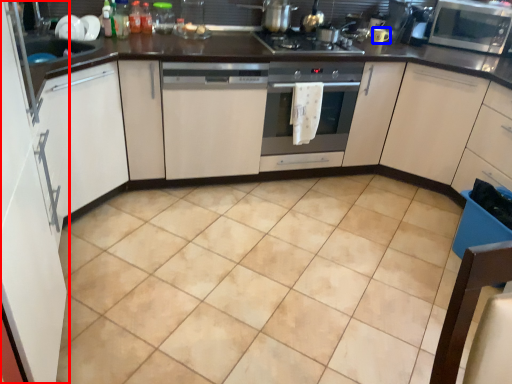
Question: Which object appears closest to the camera in this image, cabinetry (highlighted by a red box) or appliance (highlighted by a blue box)?

Choices:
 (A) cabinetry
 (B) appliance

Answer: (A)